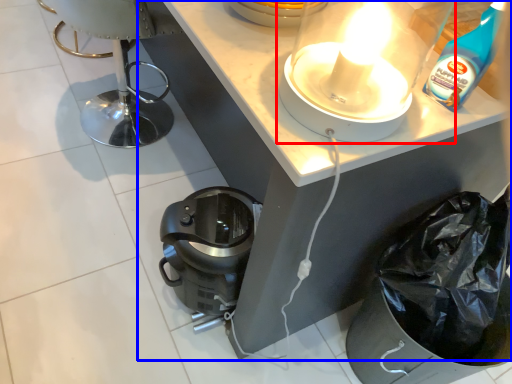
Question: Which object is closer to the camera taking this photo, kitchen appliance (highlighted by a red box) or vanity (highlighted by a blue box)?

Choices:
 (A) kitchen appliance
 (B) vanity

Answer: (A)